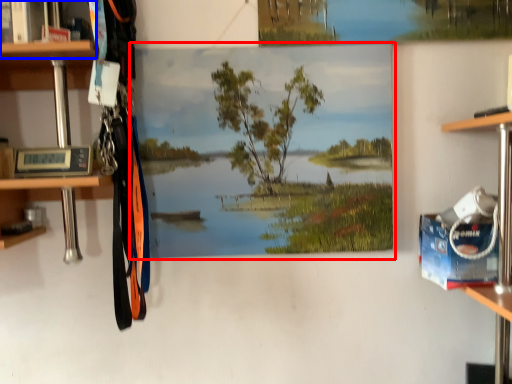
Question: Among these objects, which one is farthest to the camera, oil painting (highlighted by a red box) or cabinet (highlighted by a blue box)?

Choices:
 (A) oil painting
 (B) cabinet

Answer: (A)